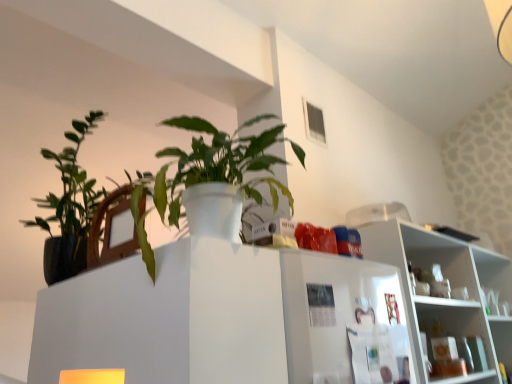
Question: Does white glossy shelf at upper right have a greater width compared to green matte plant at upper left?

Choices:
 (A) no
 (B) yes

Answer: (A)

Question: From a real-world perspective, is white glossy shelf at upper right on top of green matte plant at upper left?

Choices:
 (A) no
 (B) yes

Answer: (A)

Question: Could you tell me if white glossy shelf at upper right is turned towards green matte plant at upper left?

Choices:
 (A) yes
 (B) no

Answer: (B)

Question: From the image's perspective, is white glossy shelf at upper right located beneath green matte plant at upper left?

Choices:
 (A) yes
 (B) no

Answer: (A)

Question: Does white glossy shelf at upper right have a larger size compared to green matte plant at upper left?

Choices:
 (A) yes
 (B) no

Answer: (A)

Question: From the image's perspective, is white glossy shelf at upper right located above green matte plant at upper left?

Choices:
 (A) no
 (B) yes

Answer: (A)

Question: From the image's perspective, is green matte plant at upper left under white glossy shelf at upper right?

Choices:
 (A) no
 (B) yes

Answer: (A)

Question: Considering the relative sizes of green matte plant at upper left and white glossy shelf at upper right in the image provided, is green matte plant at upper left taller than white glossy shelf at upper right?

Choices:
 (A) no
 (B) yes

Answer: (A)

Question: From a real-world perspective, is green matte plant at upper left positioned over white glossy shelf at upper right based on gravity?

Choices:
 (A) yes
 (B) no

Answer: (A)

Question: Is green matte plant at upper left wider than white glossy shelf at upper right?

Choices:
 (A) yes
 (B) no

Answer: (A)

Question: Is green matte plant at upper left aimed at white glossy shelf at upper right?

Choices:
 (A) no
 (B) yes

Answer: (A)

Question: Considering the relative positions of green matte plant at upper left and white glossy shelf at upper right in the image provided, is green matte plant at upper left behind white glossy shelf at upper right?

Choices:
 (A) yes
 (B) no

Answer: (B)

Question: Looking at the image, does white glossy shelf at upper right seem bigger or smaller compared to green matte plant at upper left?

Choices:
 (A) big
 (B) small

Answer: (A)